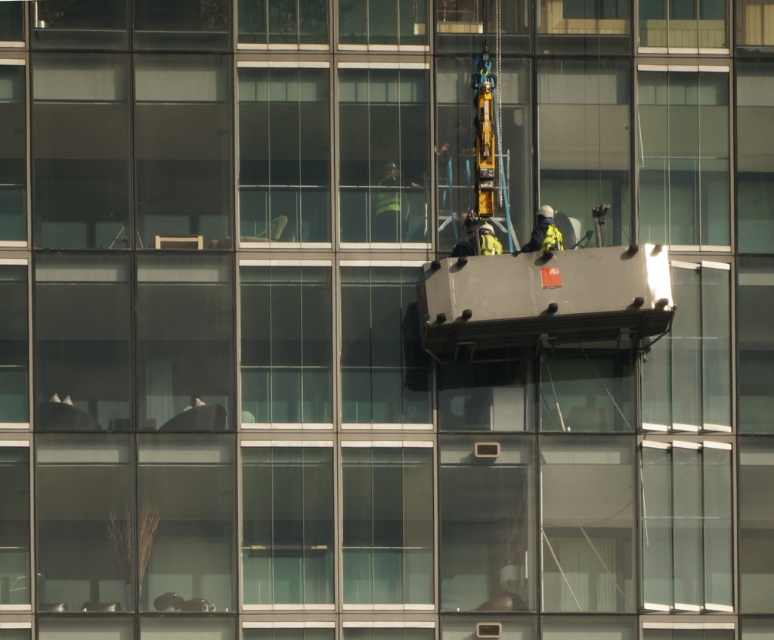
Question: Is reflective silver helmet at center wider than yellow reflective vest at center?

Choices:
 (A) no
 (B) yes

Answer: (B)

Question: Where is reflective silver helmet at center located in relation to yellow reflective vest at center in the image?

Choices:
 (A) left
 (B) right

Answer: (A)

Question: Can you confirm if reflective silver helmet at center is positioned above yellow reflective vest at center?

Choices:
 (A) no
 (B) yes

Answer: (B)

Question: Which point is farther to the camera?

Choices:
 (A) (540, 244)
 (B) (490, 228)

Answer: (B)